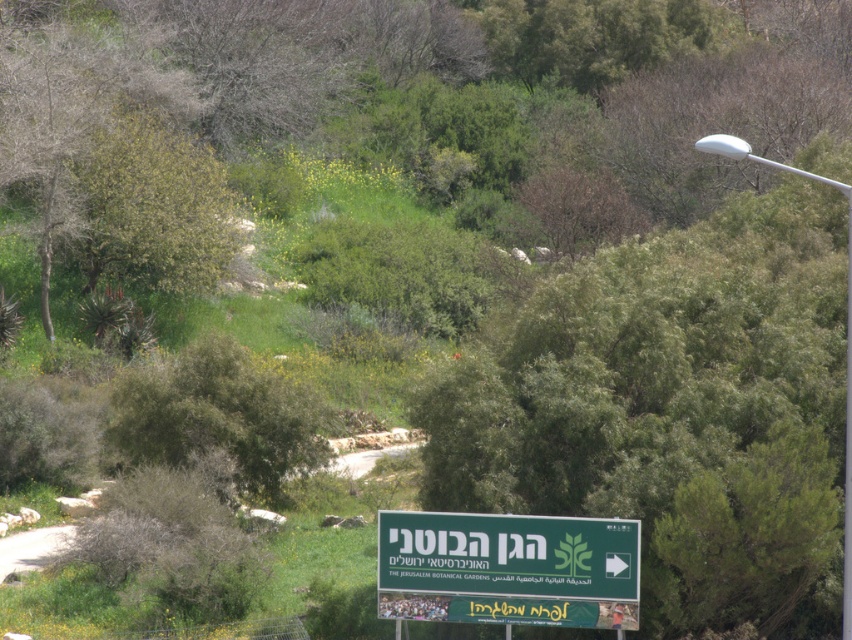
You are a hiker trying to decide which object to use for shade. The green leafy tree at center and the green plastic sign at lower center are both in your view. Which one would provide more shade coverage based on their sizes?

The green leafy tree at center has a larger width than the green plastic sign at lower center, so it would provide more shade coverage.

You are a hiker trying to reach the botanical gardens. You see the green leafy tree at center and the green plastic sign at lower center. Which object is bigger and might help you determine your direction?

The green leafy tree at center is larger in size than the green plastic sign at lower center, so the tree is bigger and could help you determine your direction by using its size as a reference point.